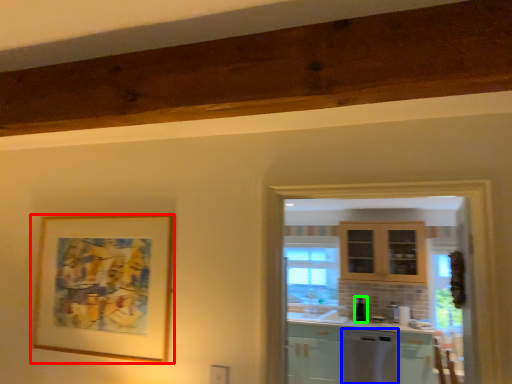
Question: Based on their relative distances, which object is nearer to picture frame (highlighted by a red box)? Choose from dish washer (highlighted by a blue box) and appliance (highlighted by a green box).

Choices:
 (A) dish washer
 (B) appliance

Answer: (A)